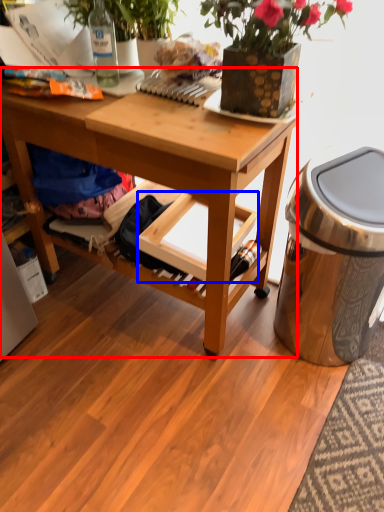
Question: Which of the following is the closest to the observer, desk (highlighted by a red box) or shelf (highlighted by a blue box)?

Choices:
 (A) desk
 (B) shelf

Answer: (A)